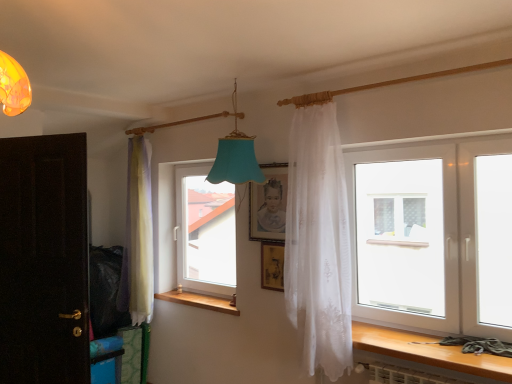
Question: Considering the positions of dark wood door at left and wooden table at lower right in the image, is dark wood door at left bigger or smaller than wooden table at lower right?

Choices:
 (A) small
 (B) big

Answer: (B)

Question: From the image's perspective, is dark wood door at left positioned above or below wooden table at lower right?

Choices:
 (A) above
 (B) below

Answer: (A)

Question: Which object is positioned closest to the pastel sheer curtains at left, the 2th curtain positioned from the right?

Choices:
 (A) transparent glass window at center, which is the 1th window in back-to-front order
 (B) wooden frame at center, positioned as the second picture frame in top-to-bottom order
 (C) wooden at left
 (D) transparent plastic window at right, positioned as the second window in back-to-front order
 (E) wooden table at lower right

Answer: (A)

Question: Which of these objects is positioned closest to the wooden table at lower right?

Choices:
 (A) wooden frame at center, positioned as the second picture frame in top-to-bottom order
 (B) transparent glass window at center, arranged as the second window when viewed from the front
 (C) wooden at left
 (D) white sheer curtain at center, the 2th curtain from the back
 (E) pastel sheer curtains at left, which is the first curtain in left-to-right order

Answer: (D)